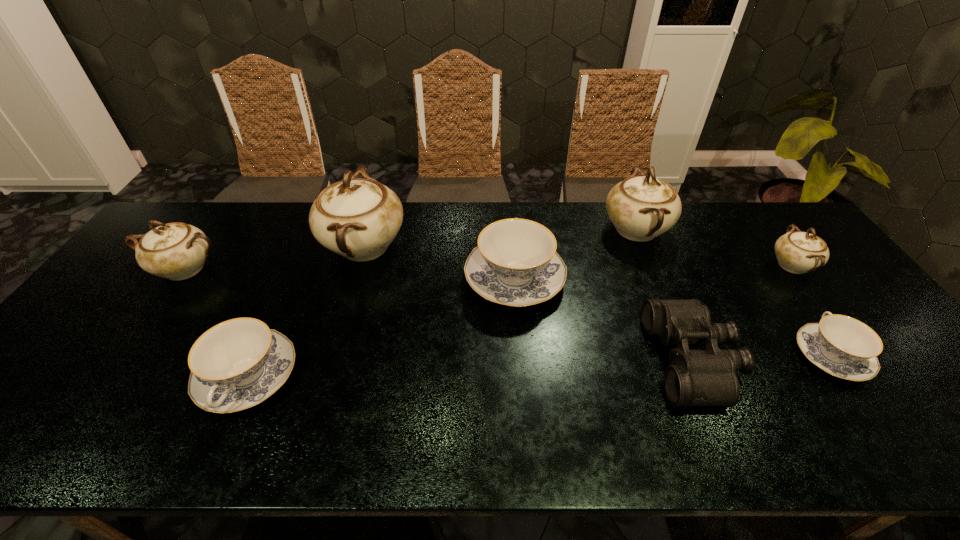
Image resolution: width=960 pixels, height=540 pixels. I want to click on object that is at the far right corner, so click(798, 252).

In order to click on vacant area at the far edge of the desktop in this screenshot , I will do `click(754, 242)`.

Locate an element on the screen. vacant space at the near edge of the desktop is located at coordinates [x=131, y=444].

Locate an element on the screen. This screenshot has height=540, width=960. free space at the left edge is located at coordinates (153, 282).

You are a GUI agent. You are given a task and a screenshot of the screen. Output one action in this format:
    pyautogui.click(x=<x>, y=<y>)
    Task: Click on the vacant space at the far right corner of the desktop
    The image size is (960, 540).
    Given the screenshot: What is the action you would take?
    pyautogui.click(x=751, y=218)

Find the location of `free area in between the second smallest white chinaware and the second biggest white chinaware`. free area in between the second smallest white chinaware and the second biggest white chinaware is located at coordinates (410, 249).

This screenshot has width=960, height=540. Identify the location of empty space that is in between the leftmost chinaware and the fifth chinaware from left to right. (410, 249).

Where is `unoccupied position between the leftmost object and the rightmost blue chinaware`? unoccupied position between the leftmost object and the rightmost blue chinaware is located at coordinates (508, 312).

Where is `free point between the second biggest blue chinaware and the second white chinaware from left to right`? free point between the second biggest blue chinaware and the second white chinaware from left to right is located at coordinates (306, 312).

Find the location of `unoccupied area between the fourth chinaware from left to right and the biggest white chinaware`. unoccupied area between the fourth chinaware from left to right and the biggest white chinaware is located at coordinates (439, 262).